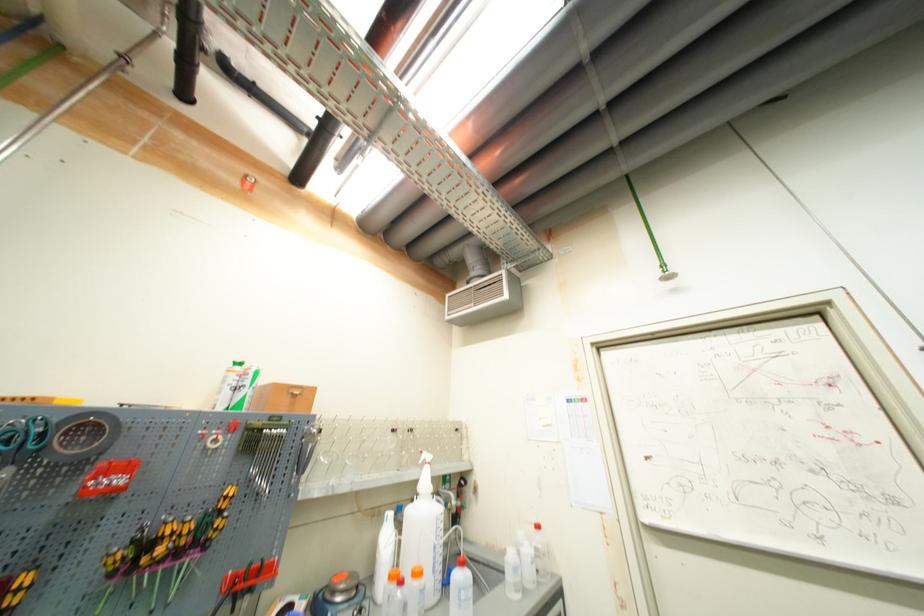
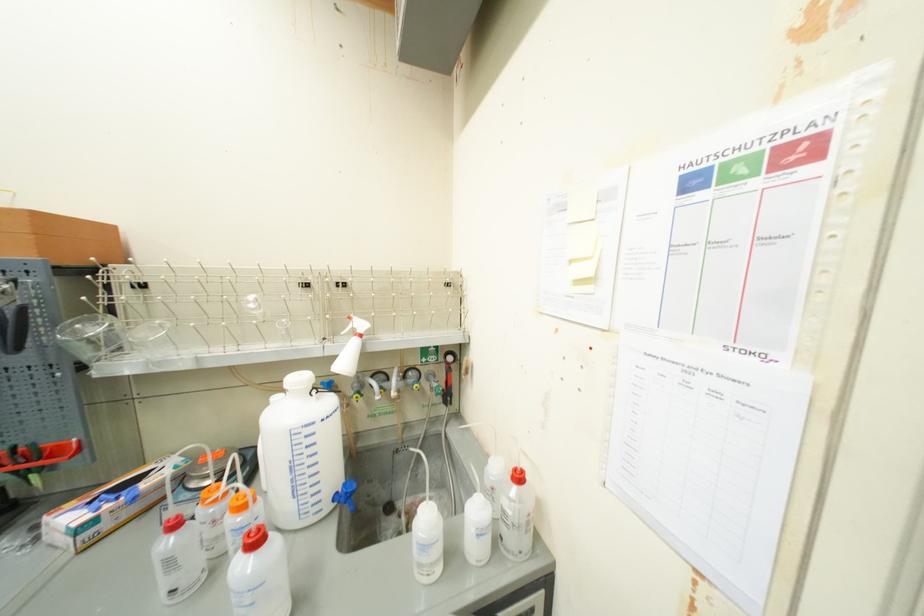
Where in the second image is the point corresponding to point 439,500 from the first image?

(317, 398)